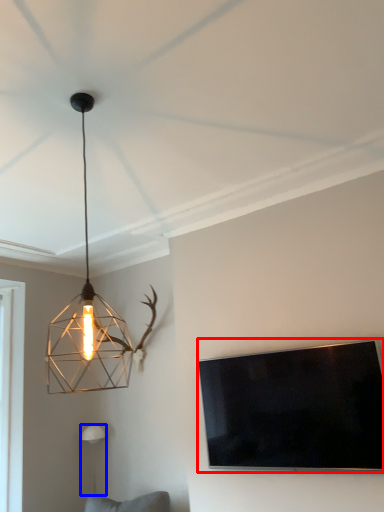
Question: Which object appears closest to the camera in this image, television (highlighted by a red box) or lamp (highlighted by a blue box)?

Choices:
 (A) television
 (B) lamp

Answer: (A)